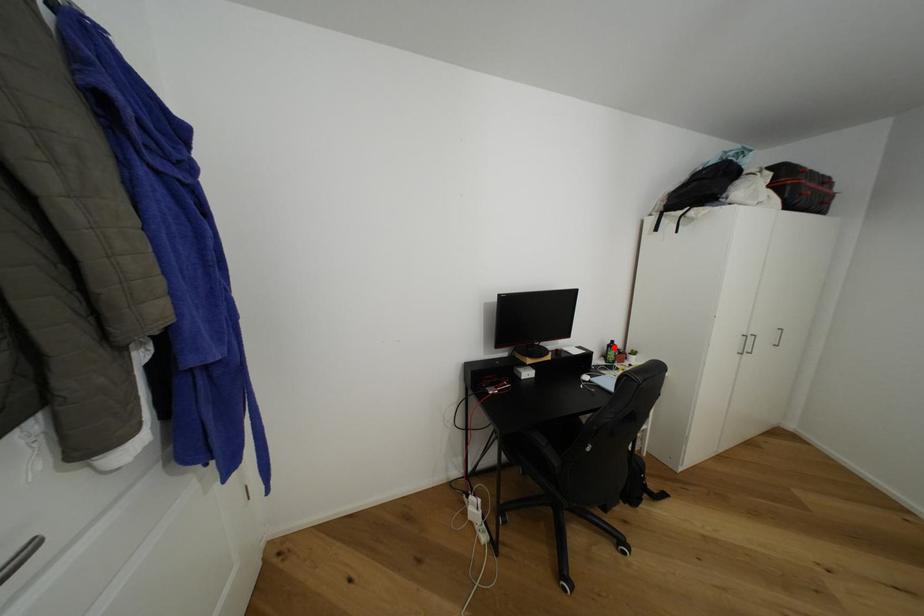
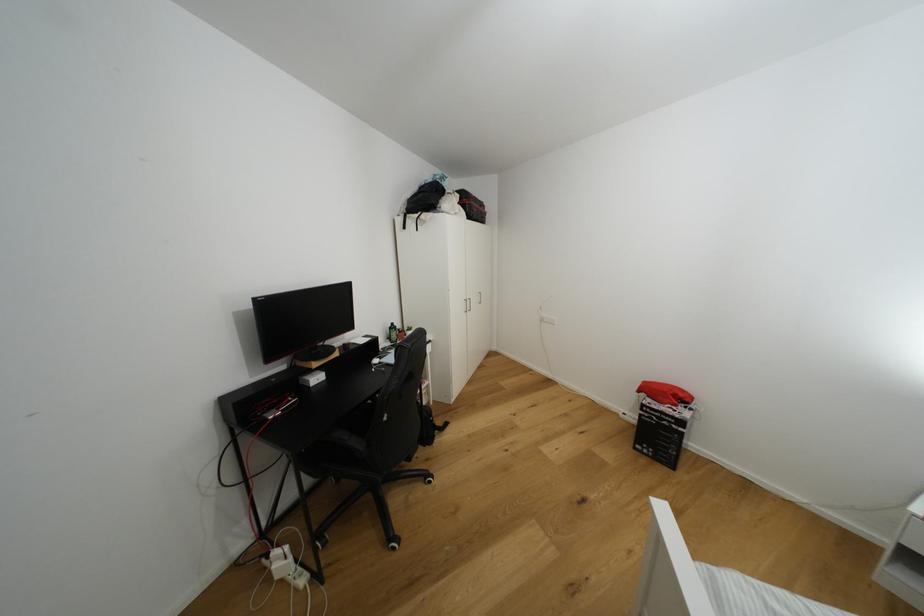
Question: I am providing you with two images of the same scene from different viewpoints. A red point is marked on the first image. Is the red point's position out of view in image 2?

Choices:
 (A) Yes
 (B) No

Answer: (B)